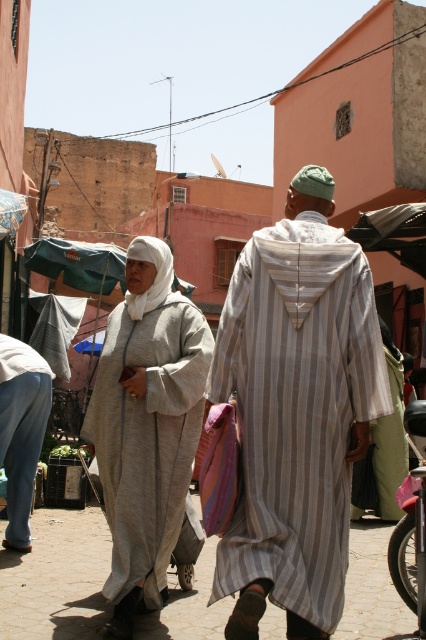
Between light gray woolen dress at center and green striped robe at center, which one has less height?

Standing shorter between the two is green striped robe at center.

In the scene shown: Is light gray woolen dress at center smaller than green striped robe at center?

Actually, light gray woolen dress at center might be larger than green striped robe at center.

Between point (112, 436) and point (397, 401), which one is positioned in front?

Positioned in front is point (112, 436).

At what (x,y) coordinates should I click in order to perform the action: click on light gray woolen dress at center. Please return your answer as a coordinate pair (x, y). Looking at the image, I should click on (147, 429).

Which is more to the left, light gray woolen dress at center or denim jeans at lower left?

denim jeans at lower left is more to the left.

Between point (176, 388) and point (28, 524), which one is positioned in front?

Point (176, 388) is more forward.

Which is in front, point (152, 410) or point (8, 355)?

Point (152, 410) is more forward.

Find the location of `light gray woolen dress at center`. light gray woolen dress at center is located at coordinates (147, 429).

Is striped cotton robe at center closer to the viewer compared to denim jeans at lower left?

Yes, it is in front of denim jeans at lower left.

Between striped cotton robe at center and denim jeans at lower left, which one appears on the right side from the viewer's perspective?

striped cotton robe at center

Is point (314, 262) positioned behind point (42, 424)?

No, it is in front of (42, 424).

The height and width of the screenshot is (640, 426). In order to click on striped cotton robe at center in this screenshot , I will do `click(296, 412)`.